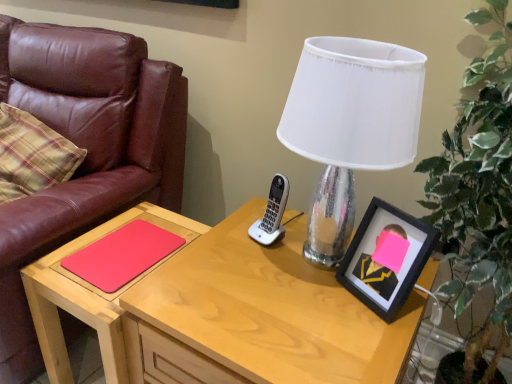
Question: Does rubberized matte red notepad at lower left lie behind black matte picture frame at right?

Choices:
 (A) yes
 (B) no

Answer: (A)

Question: Can you confirm if rubberized matte red notepad at lower left is positioned to the right of black matte picture frame at right?

Choices:
 (A) yes
 (B) no

Answer: (B)

Question: Does rubberized matte red notepad at lower left appear on the left side of black matte picture frame at right?

Choices:
 (A) yes
 (B) no

Answer: (A)

Question: Could black matte picture frame at right be considered to be inside rubberized matte red notepad at lower left?

Choices:
 (A) no
 (B) yes

Answer: (A)

Question: Is rubberized matte red notepad at lower left smaller than black matte picture frame at right?

Choices:
 (A) no
 (B) yes

Answer: (B)

Question: Is rubberized matte red notepad at lower left next to black matte picture frame at right and touching it?

Choices:
 (A) yes
 (B) no

Answer: (B)

Question: Is clear glass lamp at center at the left side of rubberized matte red notepad at lower left?

Choices:
 (A) no
 (B) yes

Answer: (A)

Question: From the image's perspective, does clear glass lamp at center appear higher than rubberized matte red notepad at lower left?

Choices:
 (A) no
 (B) yes

Answer: (B)

Question: Is clear glass lamp at center further to camera compared to rubberized matte red notepad at lower left?

Choices:
 (A) yes
 (B) no

Answer: (B)

Question: Is clear glass lamp at center directly adjacent to rubberized matte red notepad at lower left?

Choices:
 (A) yes
 (B) no

Answer: (B)

Question: Is clear glass lamp at center far from rubberized matte red notepad at lower left?

Choices:
 (A) yes
 (B) no

Answer: (B)

Question: Is clear glass lamp at center turned away from rubberized matte red notepad at lower left?

Choices:
 (A) no
 (B) yes

Answer: (A)

Question: Does matte wood table at lower left contain green leafy plant at right?

Choices:
 (A) no
 (B) yes

Answer: (A)